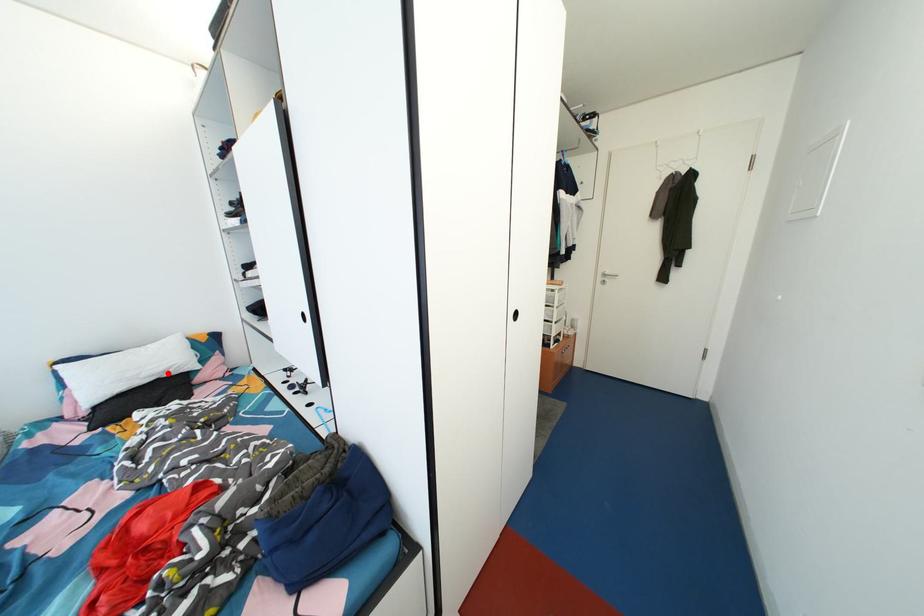
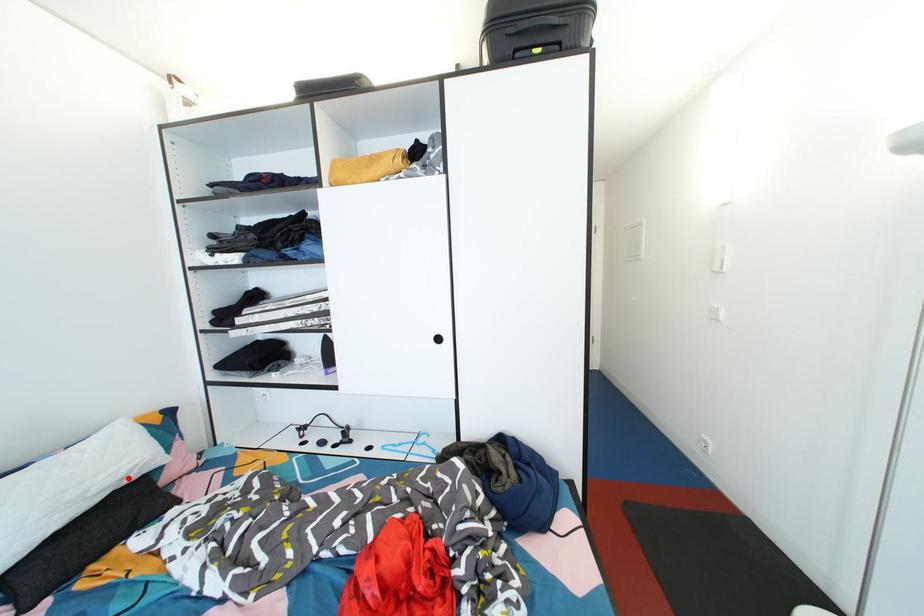
I am providing you with two images of the same scene from different viewpoints. A red point is marked on the first image and another point is marked on the second image. Do the highlighted points in image1 and image2 indicate the same real-world spot?

Yes